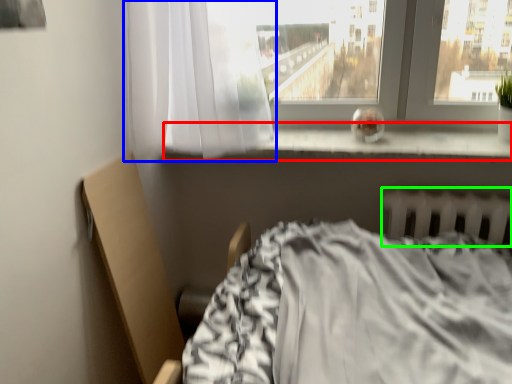
Question: Estimate the real-world distances between objects in this image. Which object is farther from window sill (highlighted by a red box), curtain (highlighted by a blue box) or radiator (highlighted by a green box)?

Choices:
 (A) curtain
 (B) radiator

Answer: (A)